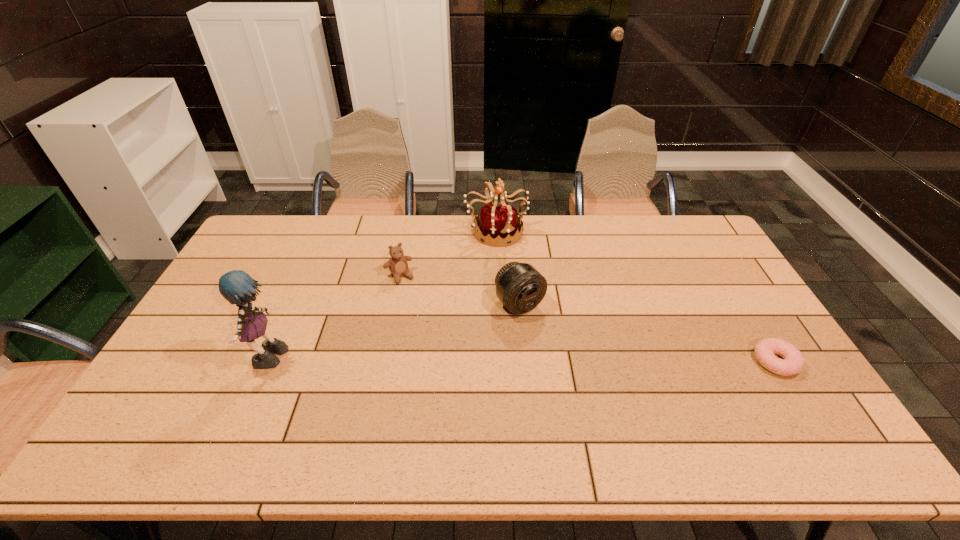
Select which object is the closest to the leftmost object. Please provide its 2D coordinates. Your answer should be formatted as a tuple, i.e. [(x, y)], where the tuple contains the x and y coordinates of a point satisfying the conditions above.

[(398, 265)]